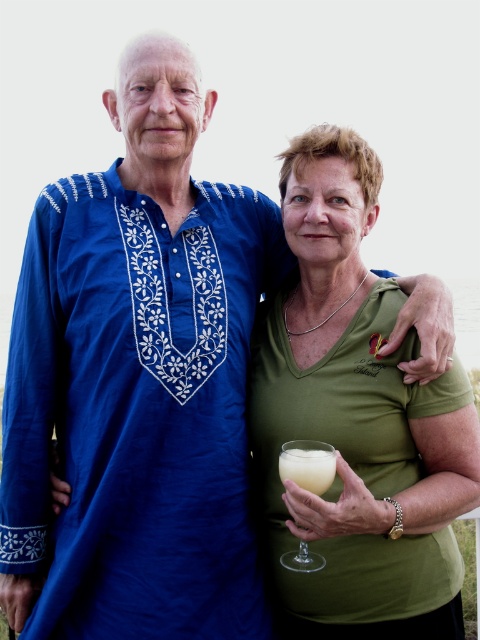
Is point (322, 401) farther from viewer compared to point (304, 440)?

Yes, point (322, 401) is farther from viewer.

Can you confirm if green matte shirt at center is shorter than pale yellow liquid at lower center?

No.

Which is behind, point (350, 224) or point (305, 480)?

Point (350, 224)

You are a GUI agent. You are given a task and a screenshot of the screen. Output one action in this format:
    pyautogui.click(x=<x>, y=<y>)
    Task: Click on the green matte shirt at center
    Image resolution: width=480 pixels, height=640 pixels.
    Given the screenshot: What is the action you would take?
    pyautogui.click(x=356, y=422)

Describe the element at coordinates (308, 465) in the screenshot. The image size is (480, 640). I see `clear glass wine glass at lower center` at that location.

From the picture: Does clear glass wine glass at lower center have a smaller size compared to pale yellow liquid at lower center?

Incorrect, clear glass wine glass at lower center is not smaller in size than pale yellow liquid at lower center.

Who is more forward, (296, 456) or (324, 461)?

Point (324, 461) is more forward.

At what (x,y) coordinates should I click in order to perform the action: click on clear glass wine glass at lower center. Please return your answer as a coordinate pair (x, y). This screenshot has height=640, width=480. Looking at the image, I should click on (308, 465).

Does green matte shirt at center have a lesser height compared to clear glass wine glass at lower center?

In fact, green matte shirt at center may be taller than clear glass wine glass at lower center.

Between green matte shirt at center and clear glass wine glass at lower center, which one appears on the left side from the viewer's perspective?

From the viewer's perspective, clear glass wine glass at lower center appears more on the left side.

Who is more distant from viewer, (453, 433) or (300, 545)?

Point (453, 433)

At what (x,y) coordinates should I click in order to perform the action: click on green matte shirt at center. Please return your answer as a coordinate pair (x, y). Looking at the image, I should click on (356, 422).